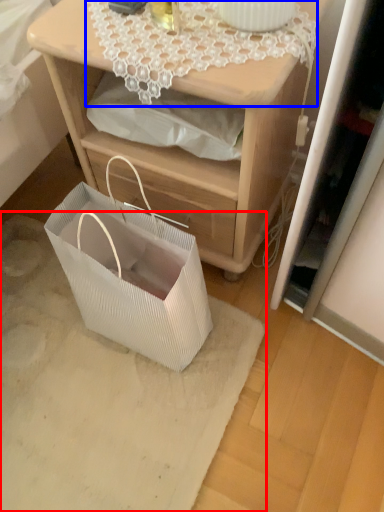
Question: Among these objects, which one is farthest to the camera, mat (highlighted by a red box) or lace (highlighted by a blue box)?

Choices:
 (A) mat
 (B) lace

Answer: (A)